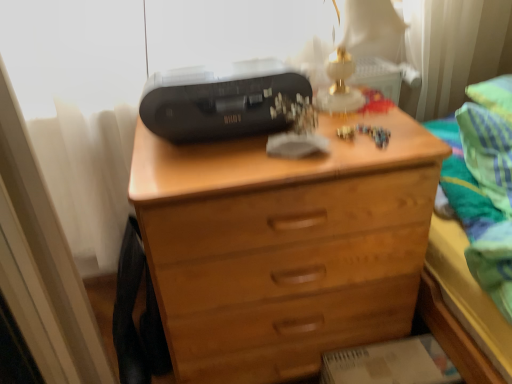
The width and height of the screenshot is (512, 384). What are the coordinates of `vacant space in front of black plastic printer at upper center` in the screenshot? It's located at (217, 165).